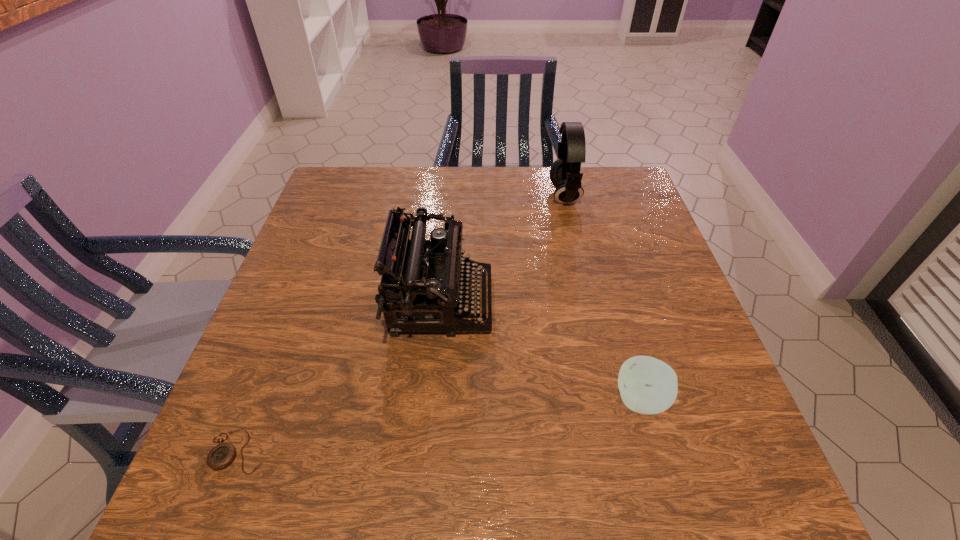
The height and width of the screenshot is (540, 960). I want to click on blank area located on the keyboard of the typewriter, so click(514, 302).

Identify the location of free space located on the back of the second nearest object. (597, 247).

Find the location of a particular element. The height and width of the screenshot is (540, 960). vacant area situated 0.170m on the right of the pocket watch is located at coordinates (365, 451).

Where is `object that is at the far edge`? This screenshot has height=540, width=960. object that is at the far edge is located at coordinates (565, 175).

This screenshot has width=960, height=540. I want to click on object that is at the near edge, so (222, 455).

Where is `object at the left edge`? object at the left edge is located at coordinates [222, 455].

You are a GUI agent. You are given a task and a screenshot of the screen. Output one action in this format:
    pyautogui.click(x=<x>, y=<y>)
    Task: Click on the object located in the right edge section of the desktop
    This screenshot has height=540, width=960.
    Given the screenshot: What is the action you would take?
    pyautogui.click(x=647, y=385)

Locate an element on the screen. The height and width of the screenshot is (540, 960). object situated at the near left corner is located at coordinates (222, 455).

Where is `free location at the far edge of the desktop`? free location at the far edge of the desktop is located at coordinates [516, 202].

Locate an element on the screen. The height and width of the screenshot is (540, 960). free space at the near edge is located at coordinates (447, 485).